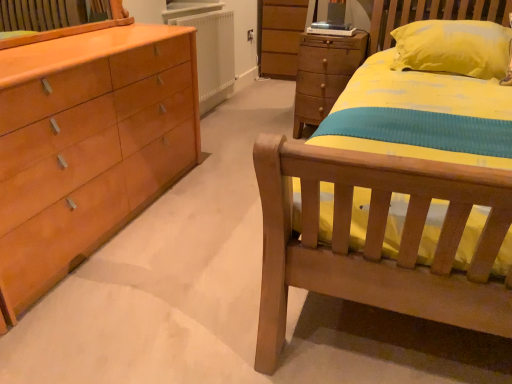
Question: From the image's perspective, is white matte radiator at center under wooden chest of drawers at center?

Choices:
 (A) yes
 (B) no

Answer: (B)

Question: Does white matte radiator at center have a greater width compared to wooden chest of drawers at center?

Choices:
 (A) yes
 (B) no

Answer: (B)

Question: From a real-world perspective, is white matte radiator at center beneath wooden chest of drawers at center?

Choices:
 (A) yes
 (B) no

Answer: (B)

Question: Is white matte radiator at center touching wooden chest of drawers at center?

Choices:
 (A) no
 (B) yes

Answer: (A)

Question: Are white matte radiator at center and wooden chest of drawers at center located far from each other?

Choices:
 (A) yes
 (B) no

Answer: (B)

Question: Can you confirm if white matte radiator at center is smaller than wooden chest of drawers at center?

Choices:
 (A) yes
 (B) no

Answer: (A)

Question: Is wooden chest of drawers at center not close to white matte radiator at center?

Choices:
 (A) yes
 (B) no

Answer: (B)

Question: From a real-world perspective, is wooden chest of drawers at center physically below white matte radiator at center?

Choices:
 (A) yes
 (B) no

Answer: (A)

Question: Is white matte radiator at center surrounded by wooden chest of drawers at center?

Choices:
 (A) yes
 (B) no

Answer: (B)

Question: Does wooden chest of drawers at center have a greater width compared to white matte radiator at center?

Choices:
 (A) no
 (B) yes

Answer: (B)

Question: Is wooden chest of drawers at center not inside white matte radiator at center?

Choices:
 (A) no
 (B) yes

Answer: (B)

Question: Considering the relative sizes of wooden chest of drawers at center and white matte radiator at center in the image provided, is wooden chest of drawers at center thinner than white matte radiator at center?

Choices:
 (A) no
 (B) yes

Answer: (A)

Question: Based on their sizes in the image, would you say wooden chest of drawers at center is bigger or smaller than white matte radiator at center?

Choices:
 (A) big
 (B) small

Answer: (A)